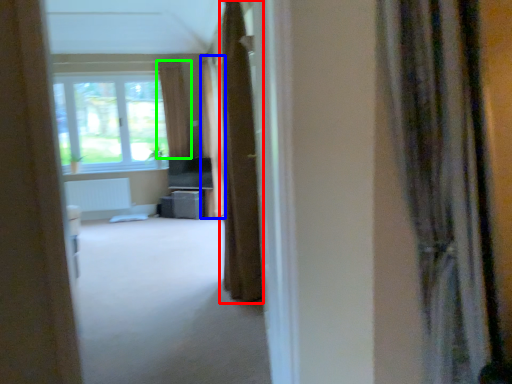
Question: Estimate the real-world distances between objects in this image. Which object is farther from curtain (highlighted by a red box), curtain (highlighted by a blue box) or curtain (highlighted by a green box)?

Choices:
 (A) curtain
 (B) curtain

Answer: (B)